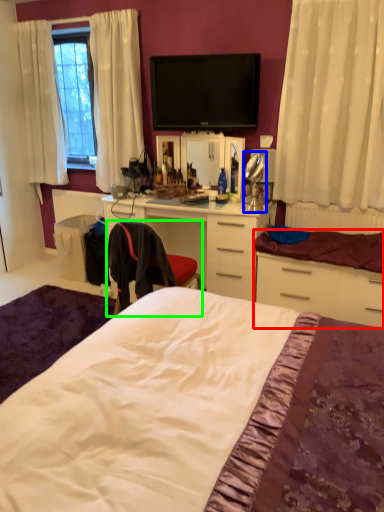
Question: Based on their relative distances, which object is nearer to cabinetry (highlighted by a red box)? Choose from table lamp (highlighted by a blue box) and chair (highlighted by a green box).

Choices:
 (A) table lamp
 (B) chair

Answer: (A)